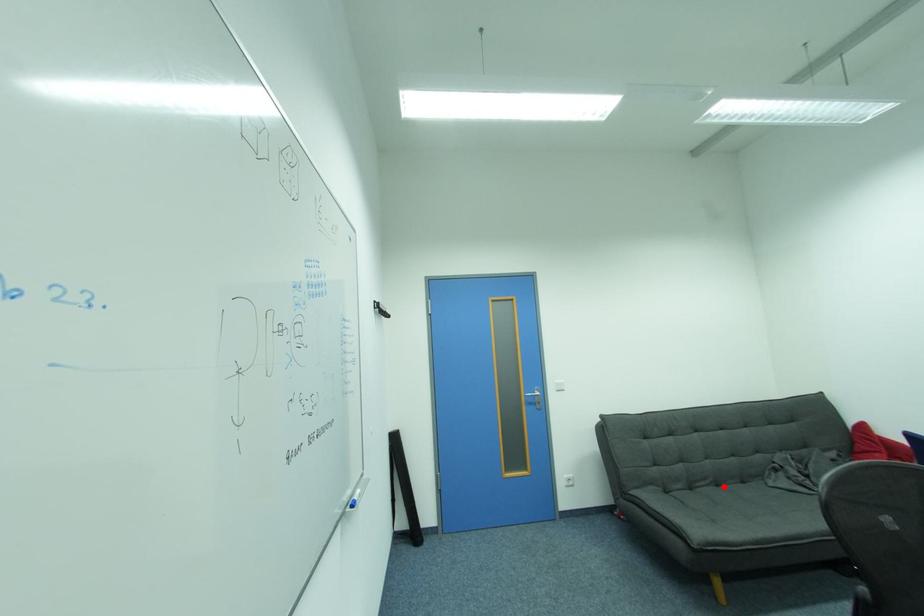
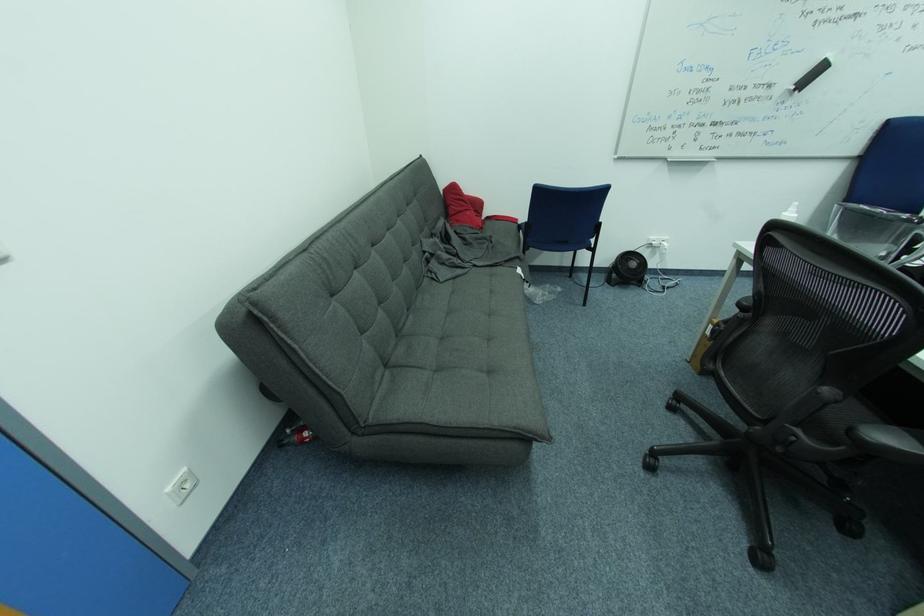
Find the pixel in the second image that matches the highlighted location in the first image.

(415, 312)